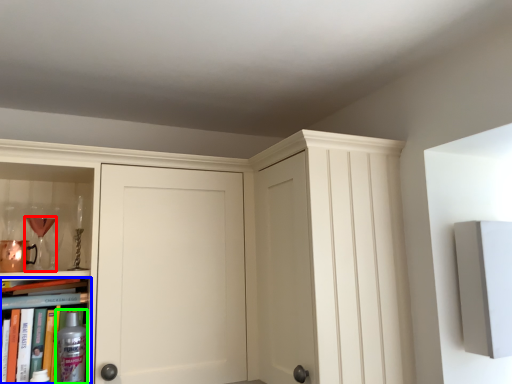
Question: Which object is positioned closest to wine glass (highlighted by a red box)? Select from book (highlighted by a blue box) and bottle (highlighted by a green box).

Choices:
 (A) book
 (B) bottle

Answer: (A)